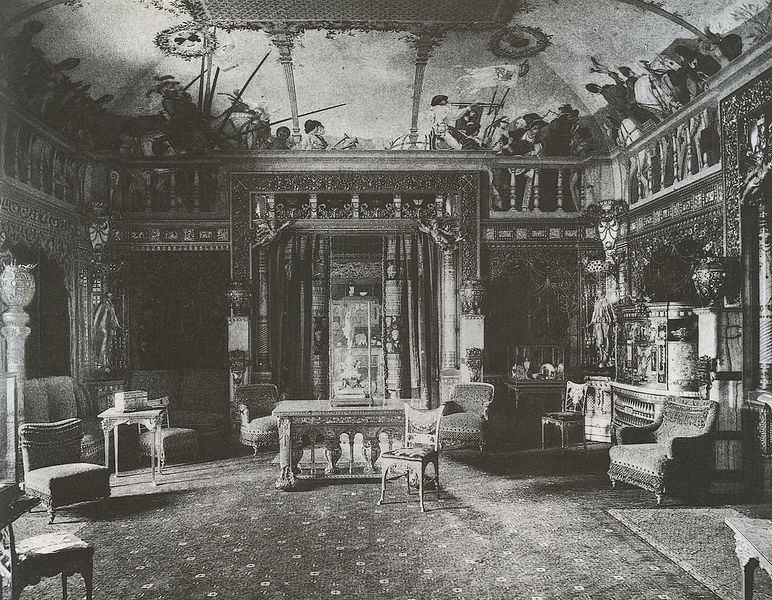
What are the coordinates of `room` in the screenshot? It's located at (262, 547).